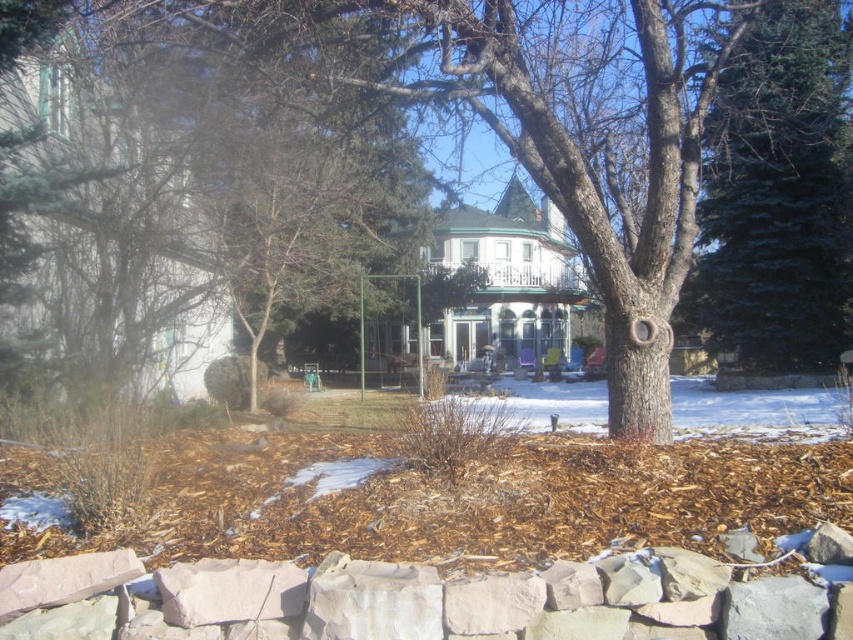
Who is lower down, brown bark tree at center or green fir tree at right?

brown bark tree at center is lower down.

Is point (355, 58) in front of point (836, 182)?

Yes, it is.

In order to click on brown bark tree at center in this screenshot , I will do `click(432, 113)`.